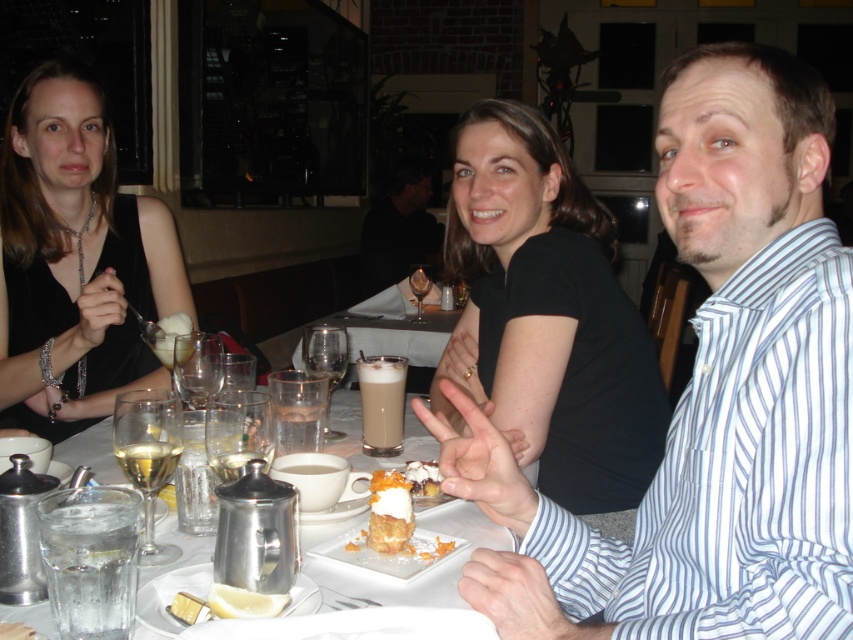
You are a waiter in a restaurant and you need to deliver a dessert to the table. The dessert is placed on the white porcelain plate at center. You want to make sure you can carry both the dessert plate and a drink without them touching. The drink is in a glass that is as thick as the white striped shirt at upper right. Can you carry them side by side?

The white striped shirt at upper right is thinner than the white porcelain plate at center. Since the drink glass is as thick as the white striped shirt at upper right, the glass is thinner than the plate. Therefore, there should be enough space to carry them side by side without touching.

Based on the photo, you are a waiter in a restaurant and you need to deliver a dessert to the customer wearing the white striped shirt at upper right. The dessert is currently on the white porcelain plate at center. Can you reach the plate without moving any other items on the table?

The white striped shirt at upper right is taller than the white porcelain plate at center, so the dessert on the white porcelain plate at center can be reached without moving other items as the shirt does not obstruct the path.